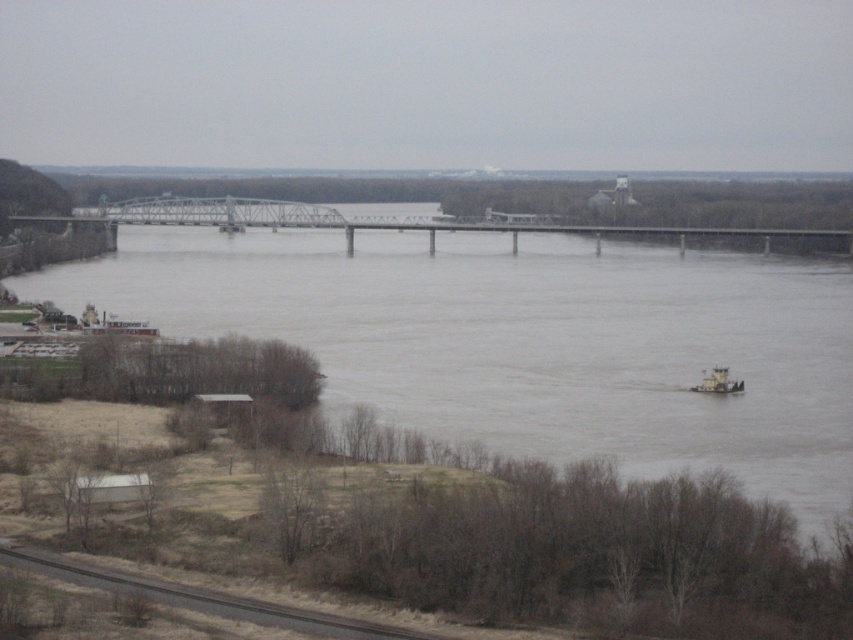
In the scene shown: Is metallic gray bridge at center thinner than dark gray asphalt train track at lower left?

Incorrect, metallic gray bridge at center's width is not less than dark gray asphalt train track at lower left's.

Looking at this image, is metallic gray bridge at center shorter than dark gray asphalt train track at lower left?

In fact, metallic gray bridge at center may be taller than dark gray asphalt train track at lower left.

Which is behind, point (82, 221) or point (366, 632)?

The point (82, 221) is more distant.

I want to click on metallic gray bridge at center, so click(364, 220).

Is point (155, 596) less distant than point (694, 388)?

That is True.

Who is taller, dark gray asphalt train track at lower left or metallic gray tugboat at lower right?

metallic gray tugboat at lower right

This screenshot has width=853, height=640. Describe the element at coordinates (204, 596) in the screenshot. I see `dark gray asphalt train track at lower left` at that location.

At what (x,y) coordinates should I click in order to perform the action: click on dark gray asphalt train track at lower left. Please return your answer as a coordinate pair (x, y). Looking at the image, I should click on (204, 596).

Based on the photo, can you confirm if gray concrete river at center is positioned below metallic gray bridge at center?

Yes, gray concrete river at center is below metallic gray bridge at center.

Who is more distant from viewer, (689, 250) or (605, 227)?

Positioned behind is point (689, 250).

You are a GUI agent. You are given a task and a screenshot of the screen. Output one action in this format:
    pyautogui.click(x=<x>, y=<y>)
    Task: Click on the gray concrete river at center
    The width and height of the screenshot is (853, 640).
    Given the screenshot: What is the action you would take?
    pyautogui.click(x=526, y=340)

Find the location of a particular element. gray concrete river at center is located at coordinates (526, 340).